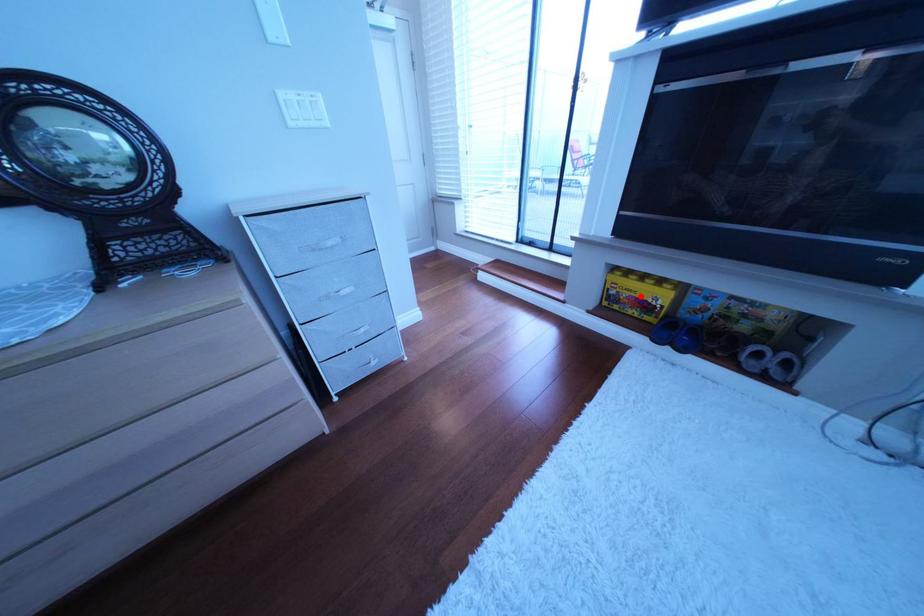
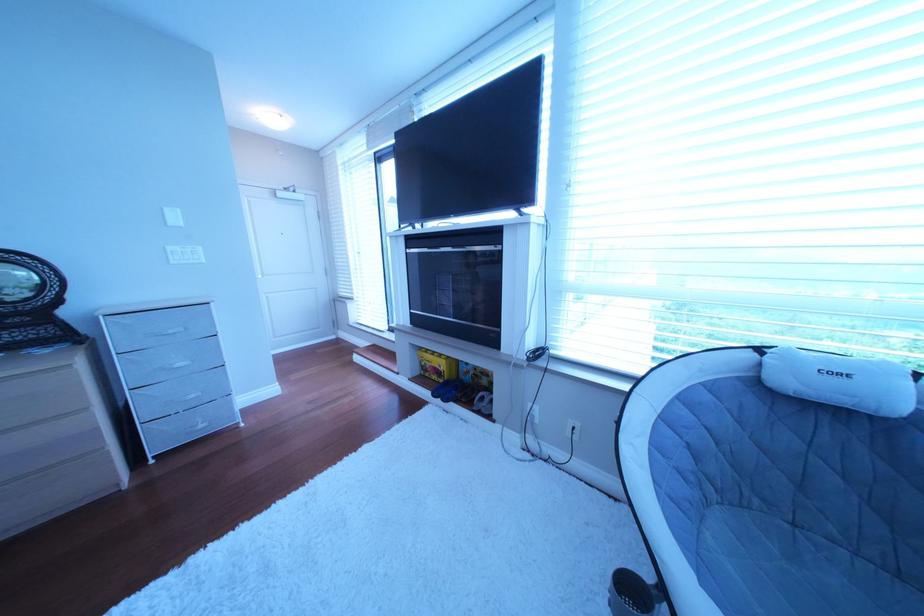
Question: I am providing you with two images of the same scene from different viewpoints. In image1, a red point is highlighted. Considering the same 3D point in image2, which of the following is correct?

Choices:
 (A) It is closer
 (B) It is farther

Answer: (B)